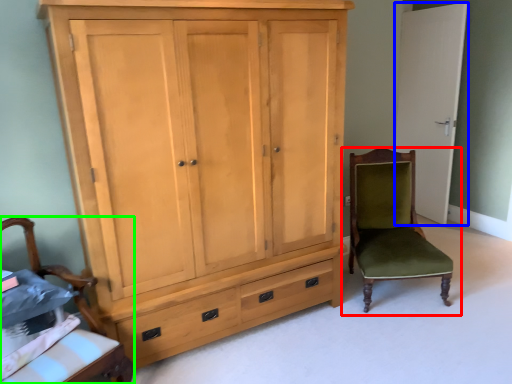
Question: Which object is positioned closest to chair (highlighted by a red box)? Select from door (highlighted by a blue box) and chair (highlighted by a green box).

Choices:
 (A) door
 (B) chair

Answer: (A)